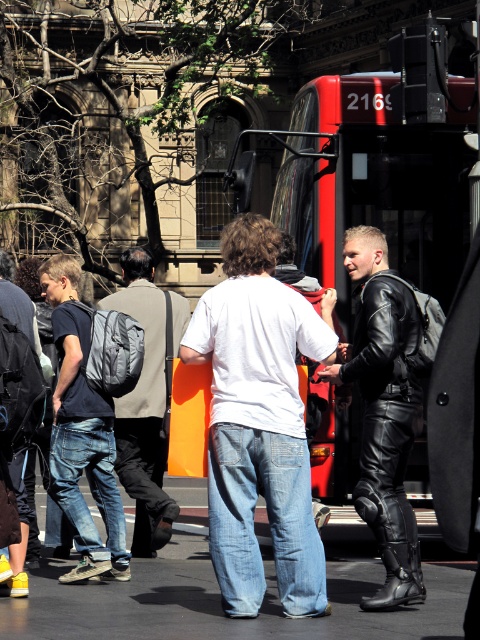
Question: Is white matte t-shirt at center above black asphalt at lower center?

Choices:
 (A) no
 (B) yes

Answer: (B)

Question: Observing the image, what is the correct spatial positioning of white matte t-shirt at center in reference to denim jeans at left?

Choices:
 (A) right
 (B) left

Answer: (A)

Question: Does black asphalt at lower center appear over denim jeans at left?

Choices:
 (A) yes
 (B) no

Answer: (B)

Question: Considering the real-world distances, which object is closest to the black asphalt at lower center?

Choices:
 (A) denim jeans at left
 (B) white matte t-shirt at center
 (C) black leather jacket at center
 (D) matte gray backpack at center

Answer: (B)

Question: Which point is closer to the camera?

Choices:
 (A) white matte t-shirt at center
 (B) matte gray backpack at center
 (C) black leather jacket at center
 (D) denim jeans at left

Answer: (A)

Question: Which of these objects is positioned closest to the black leather jacket at center?

Choices:
 (A) black asphalt at lower center
 (B) denim jeans at left
 (C) white matte t-shirt at center

Answer: (C)